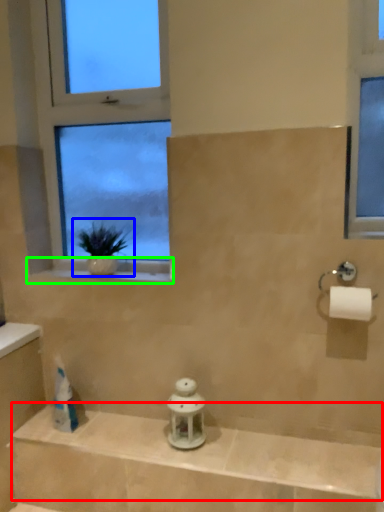
Question: Which object is the closest to the balustrade (highlighted by a red box)? Choose among these: houseplant (highlighted by a blue box) or window sill (highlighted by a green box).

Choices:
 (A) houseplant
 (B) window sill

Answer: (B)